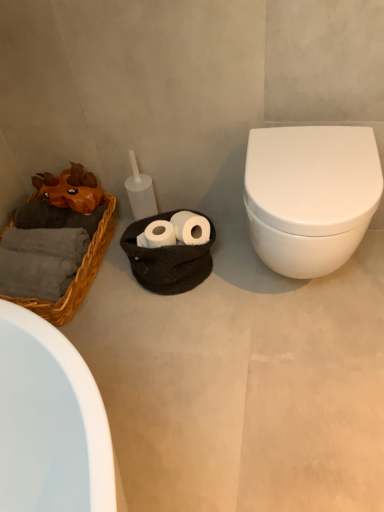
Question: From the image's perspective, is white matte toilet at right beneath white glossy toilet at right?

Choices:
 (A) yes
 (B) no

Answer: (A)

Question: Is white matte toilet at right positioned far away from white glossy toilet at right?

Choices:
 (A) no
 (B) yes

Answer: (A)

Question: Is white matte toilet at right beside white glossy toilet at right?

Choices:
 (A) yes
 (B) no

Answer: (B)

Question: Considering the relative positions of white matte toilet at right and white glossy toilet at right in the image provided, is white matte toilet at right to the left of white glossy toilet at right from the viewer's perspective?

Choices:
 (A) yes
 (B) no

Answer: (A)

Question: Is white matte toilet at right positioned with its back to white glossy toilet at right?

Choices:
 (A) no
 (B) yes

Answer: (A)

Question: Does point (44, 186) appear closer or farther from the camera than point (102, 199)?

Choices:
 (A) farther
 (B) closer

Answer: (A)

Question: Considering the positions of orange chiffonier at left and woven wicker basket at left in the image, is orange chiffonier at left wider or thinner than woven wicker basket at left?

Choices:
 (A) thin
 (B) wide

Answer: (A)

Question: In terms of size, does orange chiffonier at left appear bigger or smaller than woven wicker basket at left?

Choices:
 (A) small
 (B) big

Answer: (A)

Question: From a real-world perspective, relative to woven wicker basket at left, is orange chiffonier at left vertically above or below?

Choices:
 (A) below
 (B) above

Answer: (B)

Question: Considering the positions of white matte toilet at right and white glossy toilet at right in the image, is white matte toilet at right wider or thinner than white glossy toilet at right?

Choices:
 (A) wide
 (B) thin

Answer: (A)

Question: From the image's perspective, is white matte toilet at right above or below white glossy toilet at right?

Choices:
 (A) below
 (B) above

Answer: (A)

Question: Considering the positions of white matte toilet at right and white glossy toilet at right in the image, is white matte toilet at right bigger or smaller than white glossy toilet at right?

Choices:
 (A) small
 (B) big

Answer: (A)

Question: Would you say white matte toilet at right is to the left or to the right of white glossy toilet at right in the picture?

Choices:
 (A) left
 (B) right

Answer: (A)

Question: Based on their sizes in the image, would you say white matte toilet at right is bigger or smaller than woven wicker basket at left?

Choices:
 (A) big
 (B) small

Answer: (A)

Question: Is white matte toilet at right spatially inside woven wicker basket at left, or outside of it?

Choices:
 (A) outside
 (B) inside

Answer: (A)